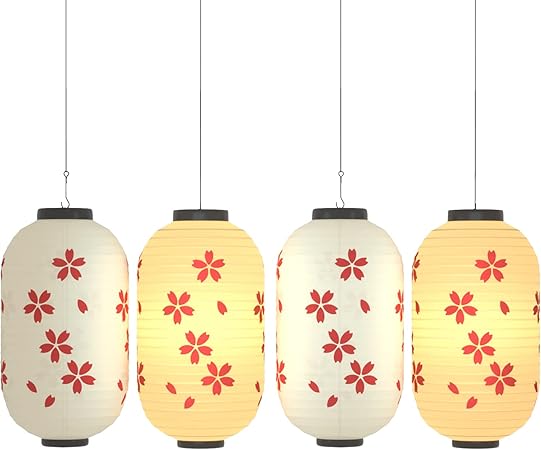
The width and height of the screenshot is (541, 450). I want to click on far left lantern, so click(x=83, y=398).